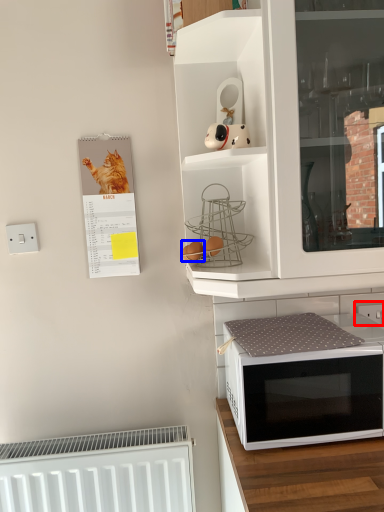
Question: Which of the following is the farthest to the observer, electric outlet (highlighted by a red box) or food (highlighted by a blue box)?

Choices:
 (A) electric outlet
 (B) food

Answer: (A)